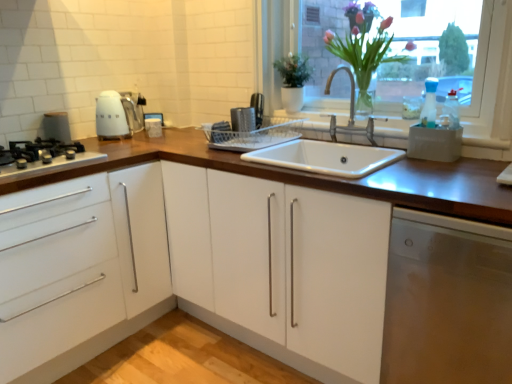
Question: Is white glossy kettle at upper left next to wooden at center and touching it?

Choices:
 (A) yes
 (B) no

Answer: (B)

Question: Can you confirm if white glossy kettle at upper left is smaller than wooden at center?

Choices:
 (A) yes
 (B) no

Answer: (A)

Question: Is there a large distance between white glossy kettle at upper left and wooden at center?

Choices:
 (A) yes
 (B) no

Answer: (B)

Question: Is white glossy kettle at upper left facing towards wooden at center?

Choices:
 (A) no
 (B) yes

Answer: (A)

Question: Can you confirm if white glossy kettle at upper left is wider than wooden at center?

Choices:
 (A) yes
 (B) no

Answer: (B)

Question: Is white glossy kettle at upper left in front of wooden at center?

Choices:
 (A) yes
 (B) no

Answer: (B)

Question: From the image's perspective, is metallic silver dish rack at center, which appears as the first appliance when viewed from the right, located beneath wooden at center?

Choices:
 (A) yes
 (B) no

Answer: (B)

Question: Is metallic silver dish rack at center, which appears as the first appliance when viewed from the right, taller than wooden at center?

Choices:
 (A) no
 (B) yes

Answer: (A)

Question: Is metallic silver dish rack at center, which appears as the first appliance when viewed from the right, positioned with its back to wooden at center?

Choices:
 (A) no
 (B) yes

Answer: (A)

Question: Does metallic silver dish rack at center, positioned as the 2th appliance in left-to-right order, turn towards wooden at center?

Choices:
 (A) yes
 (B) no

Answer: (B)

Question: Is metallic silver dish rack at center, positioned as the 2th appliance in left-to-right order, further to camera compared to wooden at center?

Choices:
 (A) no
 (B) yes

Answer: (B)

Question: Considering the relative sizes of metallic silver dish rack at center, which appears as the first appliance when viewed from the right, and wooden at center in the image provided, is metallic silver dish rack at center, which appears as the first appliance when viewed from the right, bigger than wooden at center?

Choices:
 (A) yes
 (B) no

Answer: (B)

Question: Does stainless steel dishwasher at lower right have a lesser height compared to wooden at center?

Choices:
 (A) yes
 (B) no

Answer: (A)